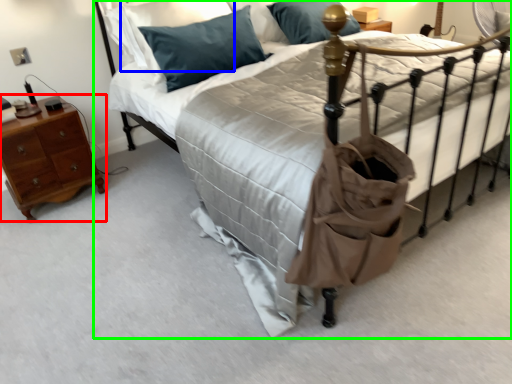
Question: Based on their relative distances, which object is nearer to nightstand (highlighted by a red box)? Choose from pillow (highlighted by a blue box) and bed (highlighted by a green box).

Choices:
 (A) pillow
 (B) bed

Answer: (A)